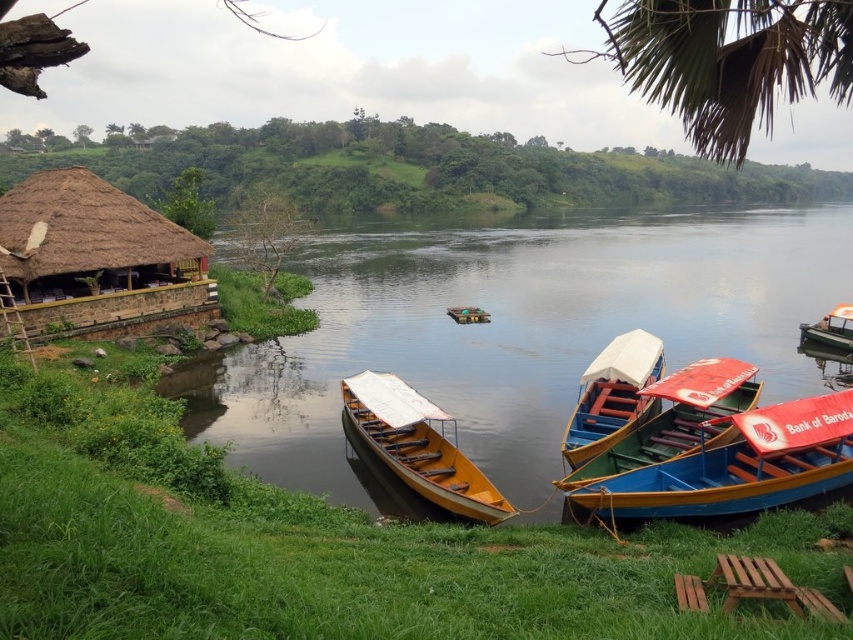
Does red plastic boat at lower right come behind green plastic boat at right?

No, it is not.

Is red plastic boat at lower right taller than green plastic boat at right?

Incorrect, red plastic boat at lower right's height is not larger of green plastic boat at right's.

Does point (682, 445) come behind point (804, 323)?

No, it is not.

Image resolution: width=853 pixels, height=640 pixels. In order to click on red plastic boat at lower right in this screenshot , I will do `click(677, 419)`.

Is blue wooden boat at lower right shorter than blue painted wood boat at center?

Correct, blue wooden boat at lower right is not as tall as blue painted wood boat at center.

Who is more forward, (647, 513) or (593, 380)?

Point (647, 513) is in front.

The width and height of the screenshot is (853, 640). What do you see at coordinates (738, 467) in the screenshot?
I see `blue wooden boat at lower right` at bounding box center [738, 467].

Image resolution: width=853 pixels, height=640 pixels. I want to click on blue wooden boat at lower right, so point(738,467).

Does thatched straw hut at left come in front of blue wooden boat at lower right?

No, thatched straw hut at left is further to the viewer.

Does thatched straw hut at left have a lesser height compared to blue wooden boat at lower right?

No.

Where is `thatched straw hut at left`? The height and width of the screenshot is (640, 853). thatched straw hut at left is located at coordinates (94, 257).